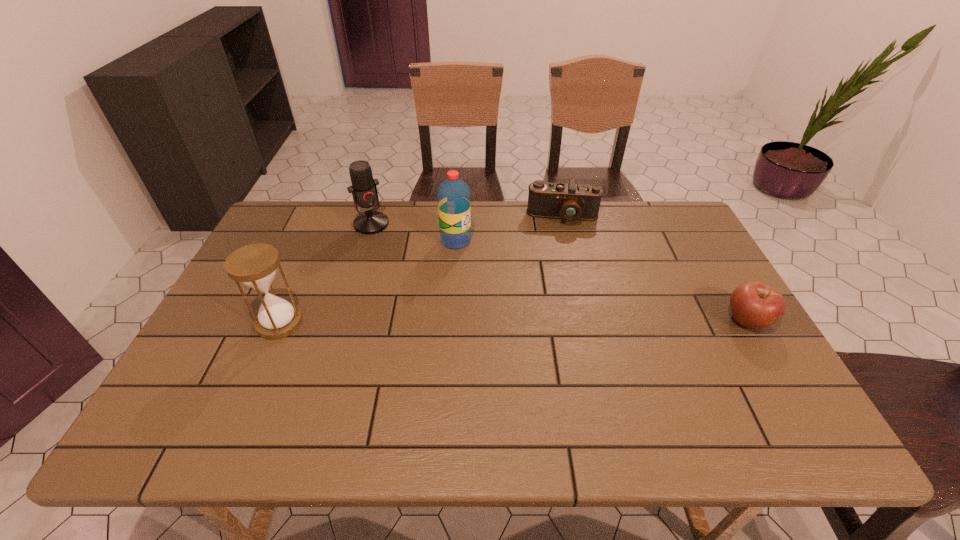
Locate an element on the screen. The image size is (960, 540). hourglass is located at coordinates coord(254,265).

Where is `the shortest object`? This screenshot has width=960, height=540. the shortest object is located at coordinates (754, 304).

Where is `the rightmost object`? This screenshot has width=960, height=540. the rightmost object is located at coordinates (754, 304).

Where is `water bottle`? water bottle is located at coordinates (453, 195).

The image size is (960, 540). Identify the location of microphone. (364, 191).

Identify the location of the fourth object from left to right. The height and width of the screenshot is (540, 960). (570, 202).

Locate an element on the screen. The height and width of the screenshot is (540, 960). vacant area situated on the right of the leftmost object is located at coordinates (402, 323).

This screenshot has width=960, height=540. I want to click on vacant space located 0.170m on the side of the apple with the unique marking, so click(x=794, y=398).

Locate an element on the screen. This screenshot has height=540, width=960. free spot located 0.360m on the front label of the third object from left to right is located at coordinates (554, 312).

Find the location of `free space located 0.310m on the front label of the third object from left to right`. free space located 0.310m on the front label of the third object from left to right is located at coordinates point(540,302).